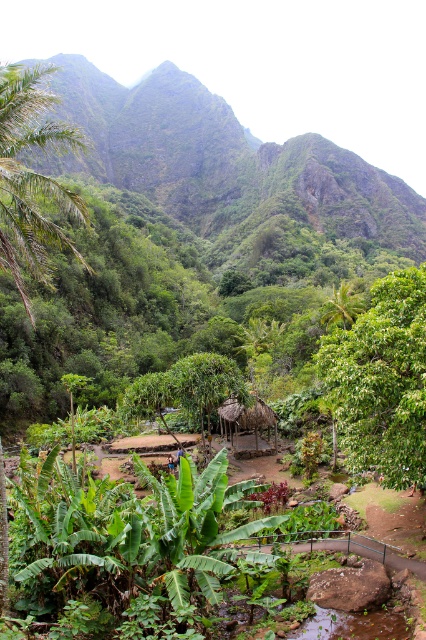
Question: Does green leafy mountain at upper center appear under green leafy palm tree at left?

Choices:
 (A) yes
 (B) no

Answer: (B)

Question: Estimate the real-world distances between objects in this image. Which object is farther from the green leafy palm tree at center?

Choices:
 (A) green leafy tree at center
 (B) green leafy mountain at upper center
 (C) green leafy palm tree at left

Answer: (B)

Question: Is green leafy palm tree at left positioned at the back of brown thatched hut at center?

Choices:
 (A) no
 (B) yes

Answer: (A)

Question: Among these points, which one is nearest to the camera?

Choices:
 (A) tap(276, 416)
 (B) tap(356, 378)
 (C) tap(57, 132)

Answer: (B)

Question: Can you confirm if green leafy mountain at upper center is wider than green leafy palm tree at center?

Choices:
 (A) no
 (B) yes

Answer: (B)

Question: Which point is farther to the camera?

Choices:
 (A) (388, 292)
 (B) (347, 291)

Answer: (B)